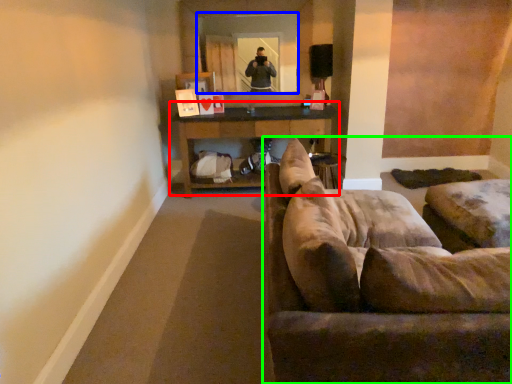
Question: Which object is the closest to the table (highlighted by a red box)? Choose among these: mirror (highlighted by a blue box) or studio couch (highlighted by a green box).

Choices:
 (A) mirror
 (B) studio couch

Answer: (A)